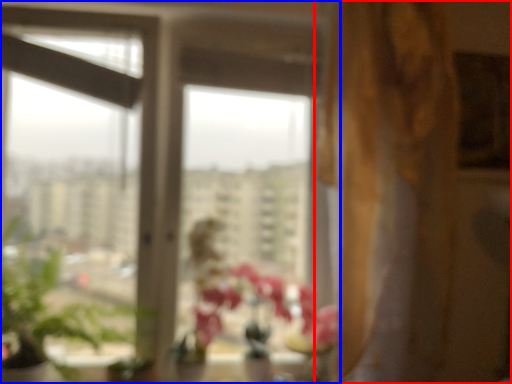
Question: Which of the following is the closest to the observer, curtain (highlighted by a red box) or window (highlighted by a blue box)?

Choices:
 (A) curtain
 (B) window

Answer: (A)